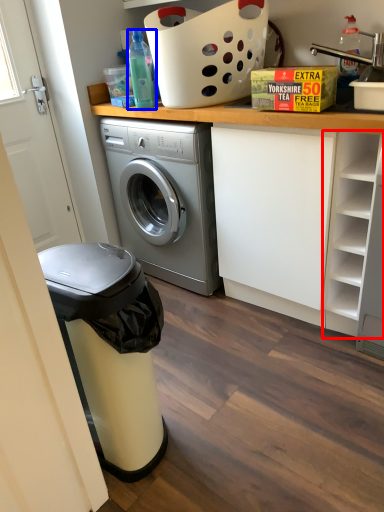
Question: Which object is further to the camera taking this photo, shelf (highlighted by a red box) or bottle (highlighted by a blue box)?

Choices:
 (A) shelf
 (B) bottle

Answer: (B)